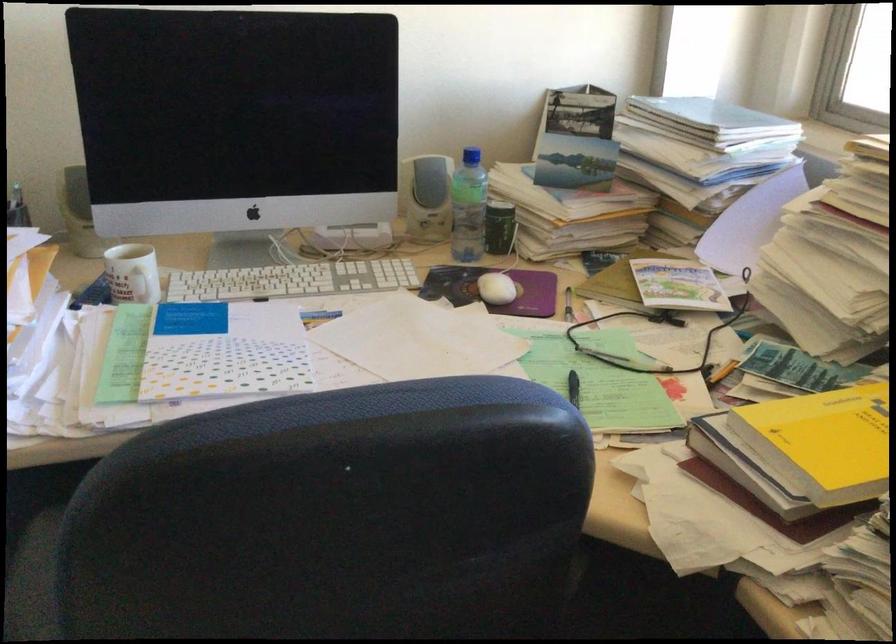
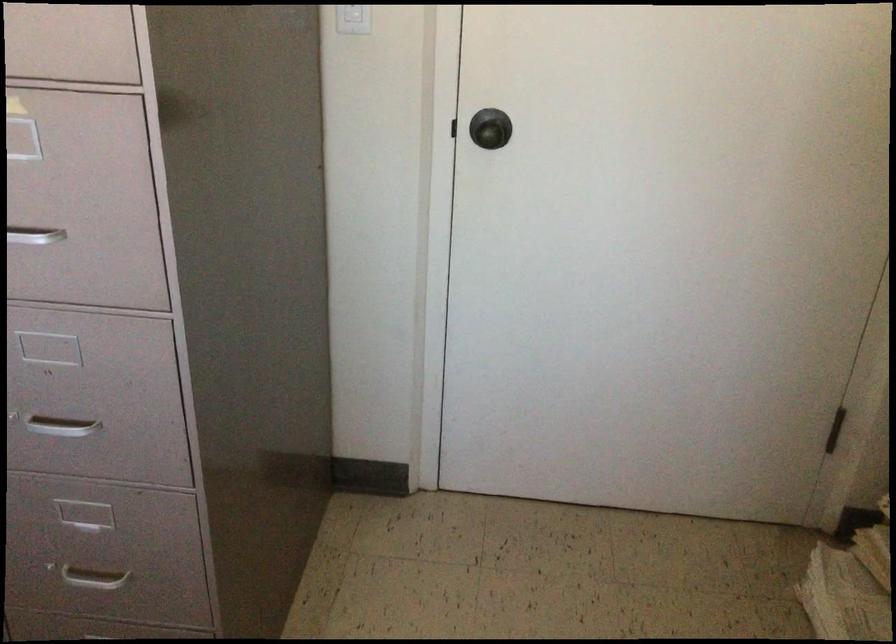
The first image is from the beginning of the video and the second image is from the end. How did the camera likely rotate when shooting the video?

The camera's rotation is toward left-down.